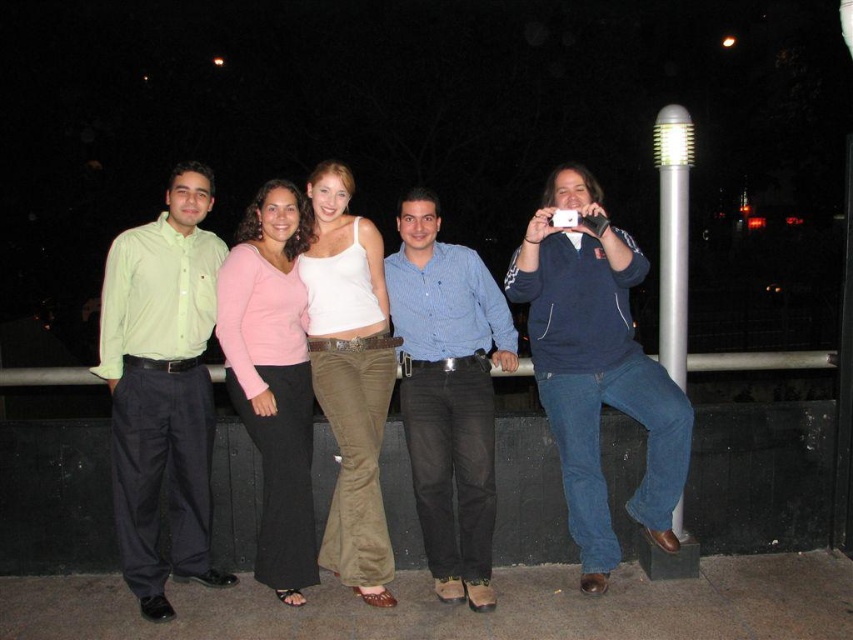
This screenshot has height=640, width=853. What are the coordinates of `light green shirt at left` in the screenshot? It's located at (161, 387).

Does light green shirt at left appear under pink sweater at center?

No.

Is point (163, 595) behind point (279, 346)?

That is False.

Locate an element on the screen. light green shirt at left is located at coordinates (161, 387).

Which is more to the right, blue cotton hoodie at right or blue checkered shirt at center?

blue cotton hoodie at right

Does blue cotton hoodie at right have a lesser width compared to blue checkered shirt at center?

No.

This screenshot has width=853, height=640. In order to click on blue cotton hoodie at right in this screenshot , I will do click(x=596, y=369).

Where is `blue cotton hoodie at right`? blue cotton hoodie at right is located at coordinates (596, 369).

In the scene shown: Is blue cotton hoodie at right smaller than pink sweater at center?

Incorrect, blue cotton hoodie at right is not smaller in size than pink sweater at center.

Find the location of `blue cotton hoodie at right`. blue cotton hoodie at right is located at coordinates (596, 369).

Is point (598, 516) positioned in front of point (291, 346)?

Yes, point (598, 516) is in front of point (291, 346).

Locate an element on the screen. blue cotton hoodie at right is located at coordinates (596, 369).